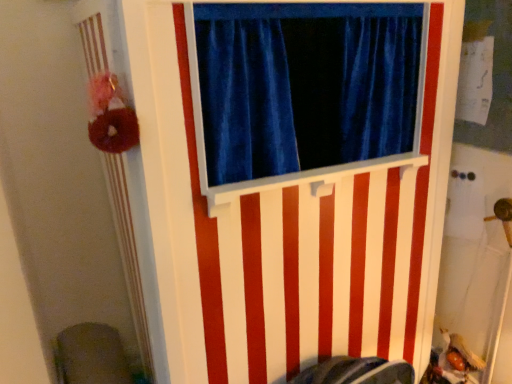
At what (x,y) coordinates should I click in order to perform the action: click on white striped barn door at center. Please return your answer as a coordinate pair (x, y). Image resolution: width=512 pixels, height=384 pixels. Looking at the image, I should click on (289, 225).

What do you see at coordinates (289, 225) in the screenshot? Image resolution: width=512 pixels, height=384 pixels. I see `white striped barn door at center` at bounding box center [289, 225].

Locate an element on the screen. The image size is (512, 384). velvet gray swivel chair at lower left is located at coordinates (91, 355).

What do you see at coordinates (91, 355) in the screenshot?
I see `velvet gray swivel chair at lower left` at bounding box center [91, 355].

This screenshot has width=512, height=384. I want to click on white striped barn door at center, so click(289, 225).

Considering the positions of objects velvet gray swivel chair at lower left and white striped barn door at center in the image provided, who is more to the left, velvet gray swivel chair at lower left or white striped barn door at center?

velvet gray swivel chair at lower left is more to the left.

Considering their positions, is velvet gray swivel chair at lower left located in front of or behind white striped barn door at center?

velvet gray swivel chair at lower left is behind white striped barn door at center.

Which point is more distant from viewer, (103, 372) or (387, 189)?

The point (103, 372) is behind.

From the image's perspective, which object appears higher, velvet gray swivel chair at lower left or white striped barn door at center?

white striped barn door at center.

From a real-world perspective, who is located lower, velvet gray swivel chair at lower left or white striped barn door at center?

velvet gray swivel chair at lower left is physically lower.

Does velvet gray swivel chair at lower left have a lesser width compared to white striped barn door at center?

Yes.

Does velvet gray swivel chair at lower left have a lesser height compared to white striped barn door at center?

Correct, velvet gray swivel chair at lower left is not as tall as white striped barn door at center.

Between velvet gray swivel chair at lower left and white striped barn door at center, which one has larger size?

Bigger between the two is white striped barn door at center.

Does velvet gray swivel chair at lower left contain white striped barn door at center?

No, white striped barn door at center is not inside velvet gray swivel chair at lower left.

Is velvet gray swivel chair at lower left far from white striped barn door at center?

No, velvet gray swivel chair at lower left is not far away from white striped barn door at center.

Could you tell me if velvet gray swivel chair at lower left is facing white striped barn door at center?

No.

How many degrees apart are the facing directions of velvet gray swivel chair at lower left and white striped barn door at center?

0.000479 degrees.

Identify the location of barn door above the velvet gray swivel chair at lower left (from the image's perspective). (289, 225).

Based on their positions, is white striped barn door at center located to the left or right of velvet gray swivel chair at lower left?

white striped barn door at center is to the right of velvet gray swivel chair at lower left.

Considering their positions, is white striped barn door at center located in front of or behind velvet gray swivel chair at lower left?

white striped barn door at center is in front of velvet gray swivel chair at lower left.

Which is closer, (x=369, y=340) or (x=131, y=381)?

Point (x=369, y=340) is closer to the camera than point (x=131, y=381).

From the image's perspective, is white striped barn door at center located beneath velvet gray swivel chair at lower left?

No.

From a real-world perspective, is white striped barn door at center physically above velvet gray swivel chair at lower left?

Yes, from a real-world perspective, white striped barn door at center is above velvet gray swivel chair at lower left.

Is white striped barn door at center wider than velvet gray swivel chair at lower left?

Yes.

Can you confirm if white striped barn door at center is shorter than velvet gray swivel chair at lower left?

No, white striped barn door at center is not shorter than velvet gray swivel chair at lower left.

Who is smaller, white striped barn door at center or velvet gray swivel chair at lower left?

Smaller between the two is velvet gray swivel chair at lower left.

Can we say white striped barn door at center lies outside velvet gray swivel chair at lower left?

Yes, white striped barn door at center is outside of velvet gray swivel chair at lower left.

Are white striped barn door at center and velvet gray swivel chair at lower left far apart?

They are positioned close to each other.

Is white striped barn door at center positioned with its back to velvet gray swivel chair at lower left?

No, white striped barn door at center is not facing away from velvet gray swivel chair at lower left.

How distant is white striped barn door at center from velvet gray swivel chair at lower left?

A distance of 30.26 inches exists between white striped barn door at center and velvet gray swivel chair at lower left.

The image size is (512, 384). What are the coordinates of `barn door lying in front of the velvet gray swivel chair at lower left` in the screenshot? It's located at [289, 225].

The width and height of the screenshot is (512, 384). What are the coordinates of `barn door that appears in front of the velvet gray swivel chair at lower left` in the screenshot? It's located at (289, 225).

Locate an element on the screen. Image resolution: width=512 pixels, height=384 pixels. swivel chair located on the left of white striped barn door at center is located at coordinates (91, 355).